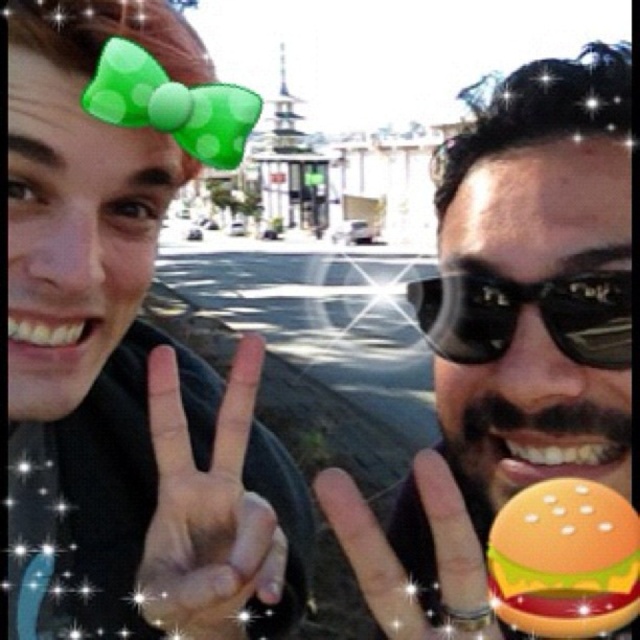
Can you confirm if green polka dot bow at upper left is positioned above black matte hand at center?

Yes, green polka dot bow at upper left is above black matte hand at center.

Does green polka dot bow at upper left have a lesser height compared to black matte hand at center?

In fact, green polka dot bow at upper left may be taller than black matte hand at center.

This screenshot has height=640, width=640. What do you see at coordinates (124, 372) in the screenshot?
I see `green polka dot bow at upper left` at bounding box center [124, 372].

Locate an element on the screen. green polka dot bow at upper left is located at coordinates (124, 372).

Can you confirm if orange matte burger at right is wider than orange plastic burger at lower right?

Indeed, orange matte burger at right has a greater width compared to orange plastic burger at lower right.

Between point (536, 204) and point (524, 588), which one is positioned behind?

Point (536, 204)

The image size is (640, 640). I want to click on orange matte burger at right, so click(509, 337).

Does black matte hand at center appear over black reflective sunglasses at right?

No.

Who is more distant from viewer, [148,552] or [586,316]?

The point [586,316] is more distant.

Is point (172, 401) less distant than point (508, 317)?

Yes.

Identify the location of black matte hand at center. (205, 512).